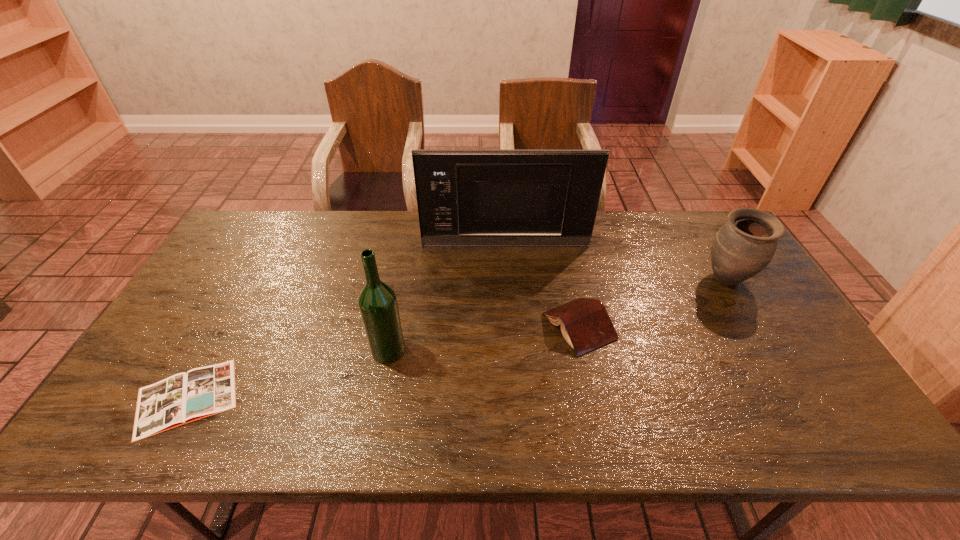
Locate which object is the fourth closest to the second shortest object. Please provide its 2D coordinates. Your answer should be formatted as a tuple, i.e. [(x, y)], where the tuple contains the x and y coordinates of a point satisfying the conditions above.

[(182, 398)]

Point out which object is positioned as the third nearest to the rightmost object. Please provide its 2D coordinates. Your answer should be formatted as a tuple, i.e. [(x, y)], where the tuple contains the x and y coordinates of a point satisfying the conditions above.

[(378, 306)]

Identify the location of free space in the image that satisfies the following two spatial constraints: 1. on the front panel of the farther book; 2. on the left side of the microwave oven. Image resolution: width=960 pixels, height=540 pixels. (511, 326).

The height and width of the screenshot is (540, 960). I want to click on free region that satisfies the following two spatial constraints: 1. on the back side of the third shortest object; 2. on the right side of the fourth object from right to left, so click(401, 280).